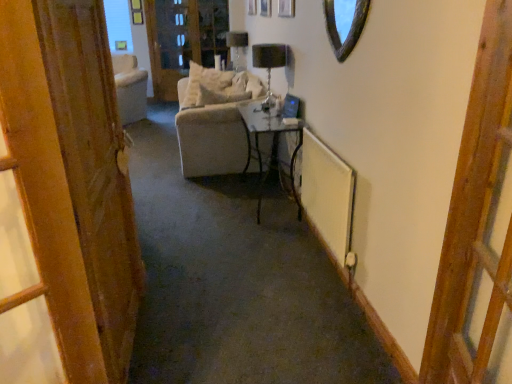
Question: Considering the positions of white fabric screen door at upper center and metallic black table at center in the image, is white fabric screen door at upper center taller or shorter than metallic black table at center?

Choices:
 (A) tall
 (B) short

Answer: (A)

Question: From the image's perspective, is white fabric screen door at upper center located above or below metallic black table at center?

Choices:
 (A) below
 (B) above

Answer: (B)

Question: Which of these objects is positioned closest to the white fabric screen door at upper center?

Choices:
 (A) wooden at right
 (B) white soft pillow at center
 (C) black glass lamp at center, which appears as the 2th lamp when viewed from the back
 (D) matte black lampshade at upper center, the first lamp positioned from the back
 (E) metallic black table at center

Answer: (D)

Question: Which object is the closest to the shiny glass mirror at upper center?

Choices:
 (A) wooden door at left
 (B) white matte radiator at right
 (C) black glass lamp at center, arranged as the second lamp when viewed from the top
 (D) metallic black table at center
 (E) white soft pillow at center

Answer: (B)